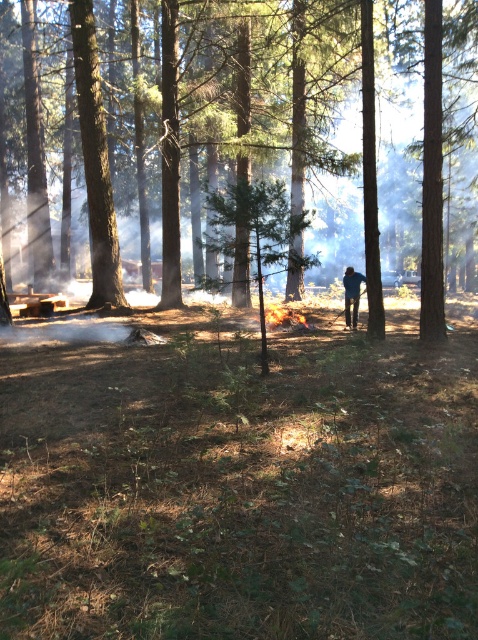
Question: Can you confirm if green textured tree at center is positioned to the left of blue denim jeans at center?

Choices:
 (A) no
 (B) yes

Answer: (B)

Question: Which point appears closest to the camera in this image?

Choices:
 (A) (x=355, y=314)
 (B) (x=428, y=260)

Answer: (B)

Question: Which object is farther from the camera taking this photo?

Choices:
 (A) blue denim jeans at center
 (B) green textured tree at center

Answer: (A)

Question: Which point is closer to the camera?

Choices:
 (A) (345, 285)
 (B) (367, 36)

Answer: (B)

Question: Can you confirm if green textured tree at center is positioned to the right of blue denim jeans at center?

Choices:
 (A) yes
 (B) no

Answer: (B)

Question: Does green textured tree at center have a greater width compared to blue denim jeans at center?

Choices:
 (A) yes
 (B) no

Answer: (A)